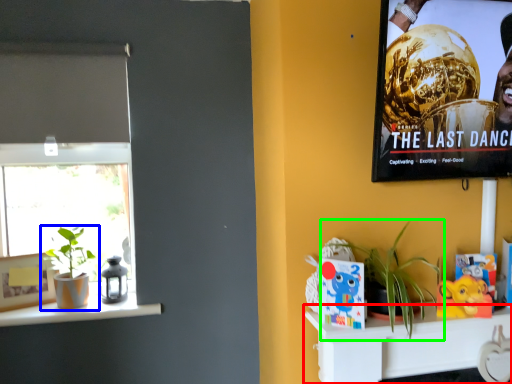
Question: Which object is positioned farthest from shelf (highlighted by a red box)? Select from houseplant (highlighted by a blue box) and houseplant (highlighted by a green box).

Choices:
 (A) houseplant
 (B) houseplant

Answer: (A)